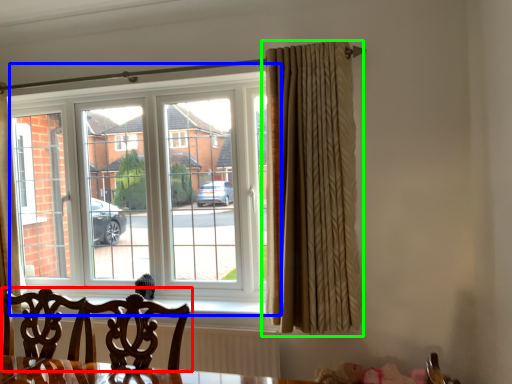
Question: Which is farther away from chair (highlighted by a red box)? window (highlighted by a blue box) or curtain (highlighted by a green box)?

Choices:
 (A) window
 (B) curtain

Answer: (A)